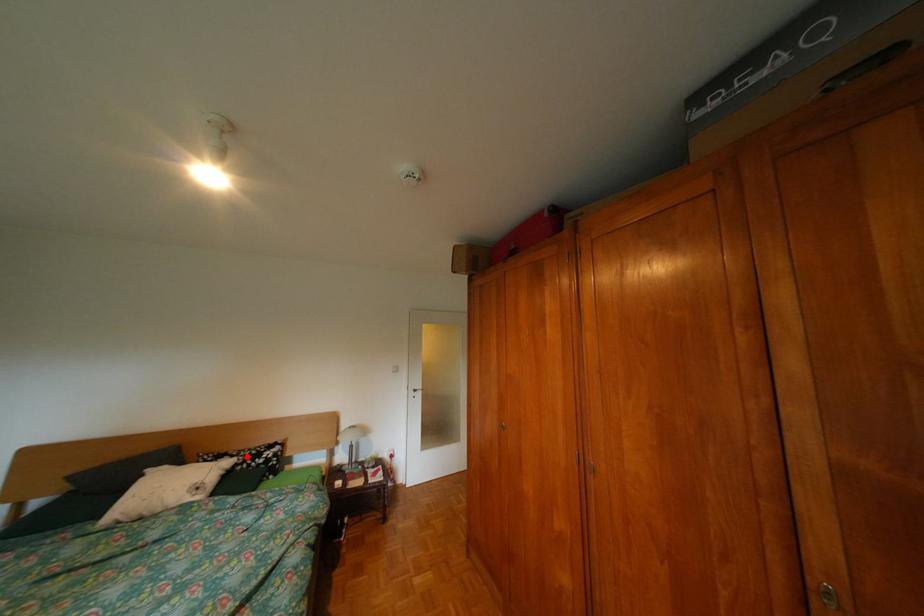
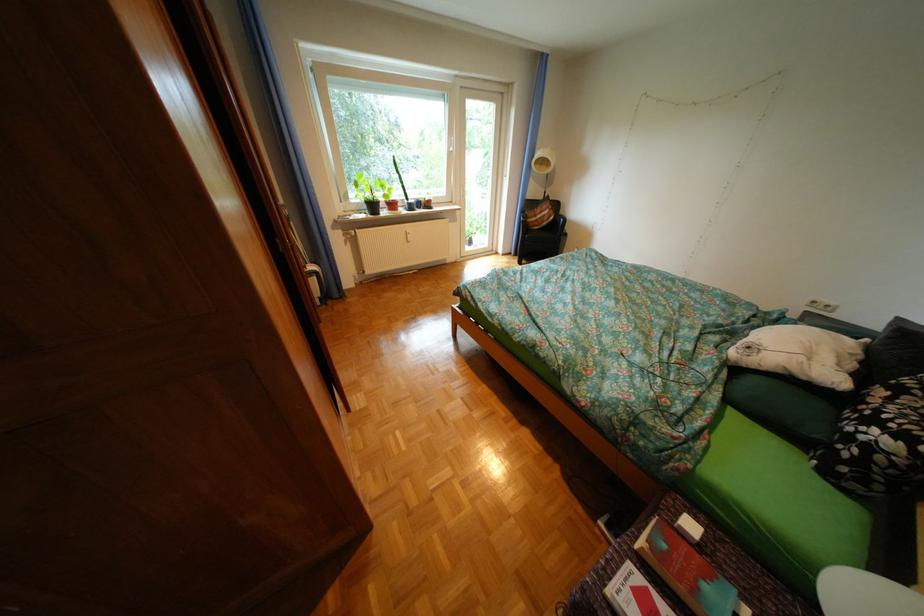
Find the pixel in the second image that matches the highlighted location in the first image.

(904, 399)